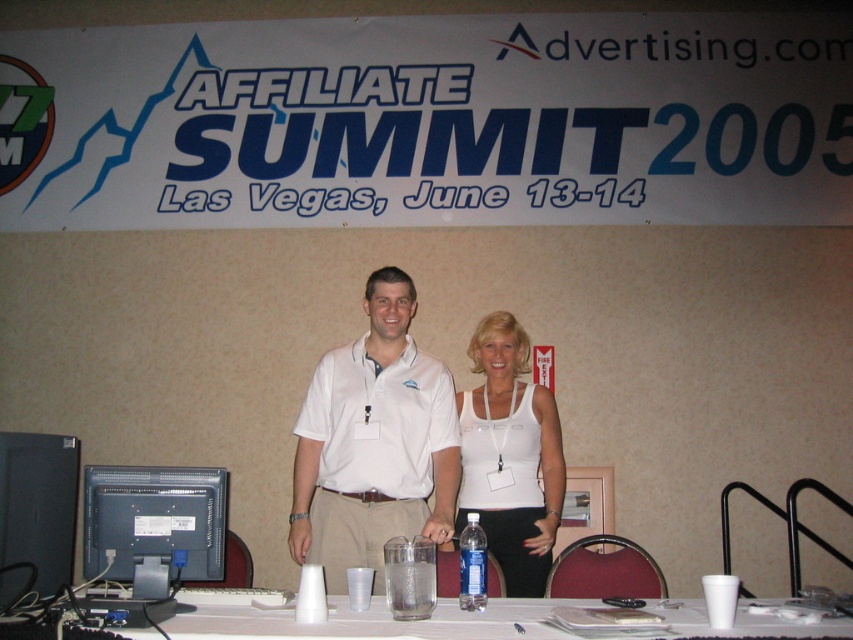
You are standing at the Affiliate Summit 2005 booth and want to take a photo of the white matte tank top at center. If your camera can focus on objects up to 3 meters away, will you be able to capture a clear image?

The white matte tank top at center is 3.10 meters from the viewer, which is slightly beyond the camera focus limit of 3 meters. Therefore, the camera may not capture a clear image due to the distance being 0.10 meters too far.

You are standing at the conference booth and want to know how far the point at coordinates (x=200, y=477) is from your current position. Can you determine the distance?

The point at coordinates (x=200, y=477) is 6.95 feet away from the camera, so the distance from your current position would be approximately 6.95 feet.